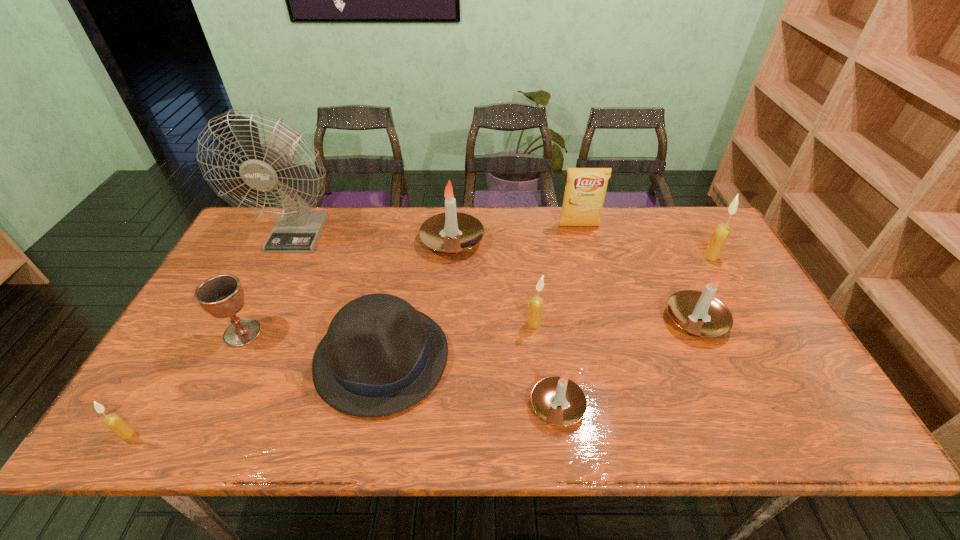
Where is `gray fan`? The width and height of the screenshot is (960, 540). gray fan is located at coordinates (297, 230).

Locate an element on the screen. The image size is (960, 540). fan is located at coordinates (297, 230).

Find the location of a particular element. the fifth candle from right to left is located at coordinates (452, 232).

Locate an element on the screen. This screenshot has width=960, height=540. the leftmost white candle is located at coordinates (452, 232).

Where is `the rightmost cream candle`? The height and width of the screenshot is (540, 960). the rightmost cream candle is located at coordinates (720, 235).

Find the location of a particular element. The height and width of the screenshot is (540, 960). the biggest cream candle is located at coordinates (720, 235).

Locate an element on the screen. Image resolution: width=960 pixels, height=540 pixels. crisp (potato chip) is located at coordinates (585, 190).

Find the location of a particular element. This screenshot has height=540, width=960. the second cream candle from left to right is located at coordinates (536, 303).

Locate an element on the screen. This screenshot has width=960, height=540. the second nearest cream candle is located at coordinates (536, 303).

Locate an element on the screen. This screenshot has height=540, width=960. the rightmost white candle is located at coordinates (699, 313).